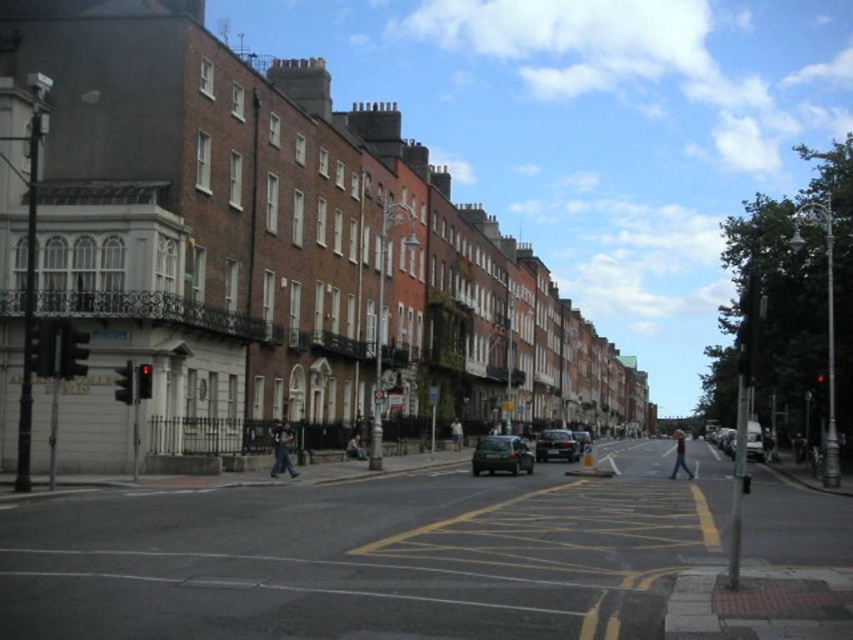
You are a pedestrian standing on the street and see a person wearing dark blue jeans at center and dark gray fabric jacket at center. Which clothing item is taller?

The dark blue jeans at center is much taller than the dark gray fabric jacket at center.

You are a pedestrian standing on the sidewalk of the street scene. You see a light blue jeans at center and a light brown leather jacket at center. Which item is located lower in the image?

The light blue jeans at center is positioned under light brown leather jacket at center, so the light blue jeans at center is located lower in the image.

You are a pedestrian standing at the intersection and see a dark blue jeans at center and a dark gray fabric jacket at center. Which one is closer to you?

The dark blue jeans at center is 32.50 meters away from dark gray fabric jacket at center, so the dark gray fabric jacket at center is closer to you.